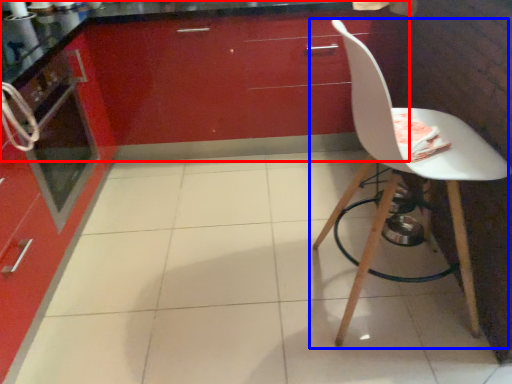
Question: Which of the following is the closest to the observer, cabinetry (highlighted by a red box) or chair (highlighted by a blue box)?

Choices:
 (A) cabinetry
 (B) chair

Answer: (B)